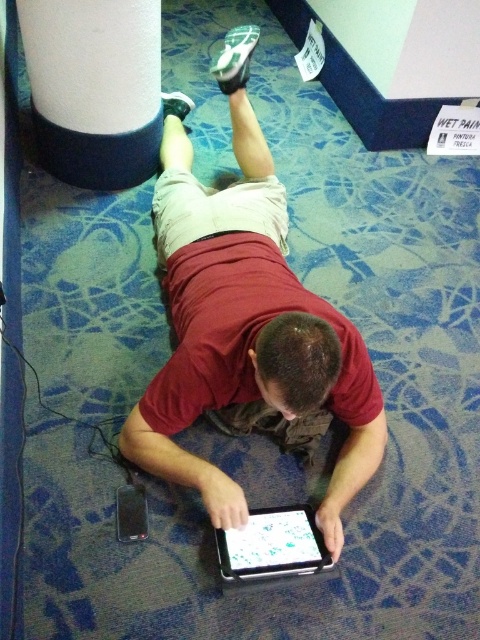
Question: Is matte black tablet at center thinner than white matte cylinder at upper left?

Choices:
 (A) yes
 (B) no

Answer: (B)

Question: Is matte black tablet at center below black glossy tablet at center?

Choices:
 (A) yes
 (B) no

Answer: (B)

Question: Is matte black tablet at center in front of black glossy tablet at center?

Choices:
 (A) no
 (B) yes

Answer: (B)

Question: Which point is farther to the camera?

Choices:
 (A) (48, 138)
 (B) (251, 564)
 (C) (253, 136)

Answer: (A)

Question: Estimate the real-world distances between objects in this image. Which object is closer to the white matte cylinder at upper left?

Choices:
 (A) black glossy tablet at center
 (B) matte black tablet at center

Answer: (B)

Question: Which of the following is the closest to the observer?

Choices:
 (A) (88, 51)
 (B) (286, 307)
 (C) (228, 561)

Answer: (C)